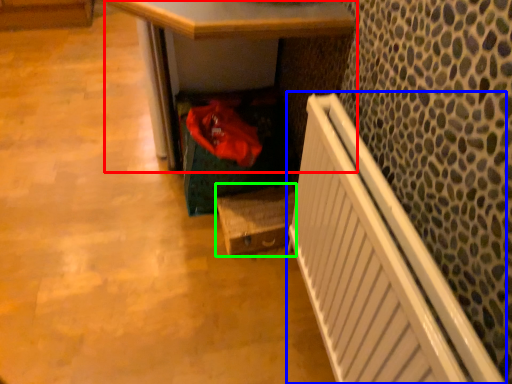
Question: Considering the real-world distances, which object is closest to desk (highlighted by a red box)? radiator (highlighted by a blue box) or box (highlighted by a green box).

Choices:
 (A) radiator
 (B) box

Answer: (B)